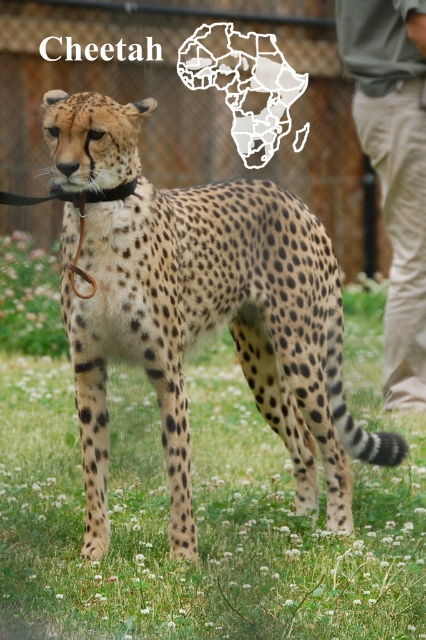
You are a zookeeper who needs to attach a new GPS tracker to the black leather neckband at center. The tracker requires a clear line of sight to satellites and must be placed at least 2 meters away from any obstructions like the green grass at center. Based on the scene description, will the tracker function properly when attached to the neckband?

The green grass at center is 1.79 meters from the black leather neckband at center. Since the required distance for the tracker is at least 2 meters, the tracker will not have enough clearance and may not function properly.

You are a wildlife photographer who wants to capture the cheetah in the image. Since the green grass at center and the black leather neckband at center are both at the center, which one is closer to the camera?

The green grass at center is much taller than the black leather neckband at center, so the grass is closer to the camera.